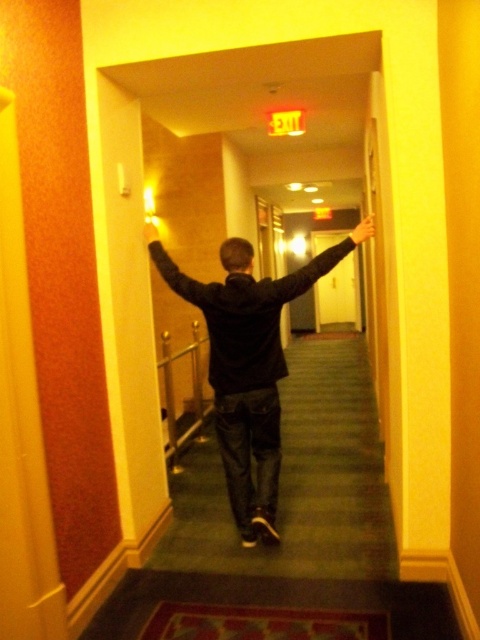
Question: Which is nearer to the matte black arm at upper center?

Choices:
 (A) smooth yellow hand at center
 (B) dark gray hoodie at center

Answer: (A)

Question: Which point is farther to the camera?

Choices:
 (A) smooth yellow hand at center
 (B) yellow matte door at center
 (C) matte black arm at upper center
 (D) smooth skin hand at upper center

Answer: (B)

Question: Is yellow matte door at center to the left of smooth skin hand at upper center from the viewer's perspective?

Choices:
 (A) yes
 (B) no

Answer: (B)

Question: Is the position of matte black arm at upper center more distant than that of smooth yellow hand at center?

Choices:
 (A) yes
 (B) no

Answer: (B)

Question: Which point is farther to the camera?

Choices:
 (A) smooth skin hand at upper center
 (B) dark gray hoodie at center
 (C) yellow matte door at center

Answer: (C)

Question: Is yellow matte door at center to the left of matte black arm at upper center from the viewer's perspective?

Choices:
 (A) no
 (B) yes

Answer: (A)